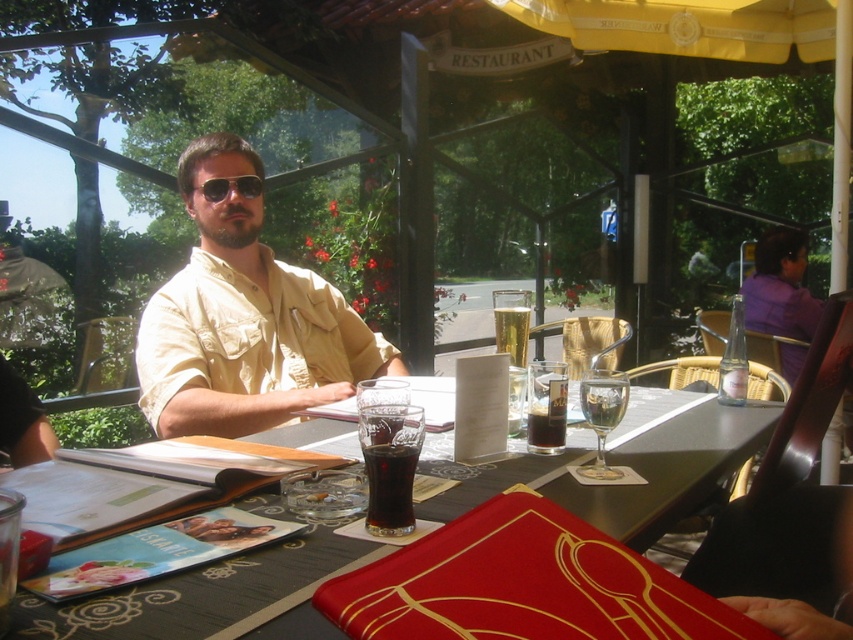
Question: Is beige cotton shirt at center below matte black sunglasses at center?

Choices:
 (A) no
 (B) yes

Answer: (B)

Question: Among these objects, which one is nearest to the camera?

Choices:
 (A) clear glass wine glass at table center
 (B) dark brown glass at table center

Answer: (A)

Question: Which point is farther to the camera?

Choices:
 (A) click(561, 417)
 (B) click(601, 451)
 (C) click(142, 352)
 (D) click(242, 184)

Answer: (D)

Question: Can you confirm if dark glass coca-cola at center is bigger than matte black sunglasses at center?

Choices:
 (A) yes
 (B) no

Answer: (B)

Question: Which is nearer to the clear glass wine glass at table center?

Choices:
 (A) matte glass table at center
 (B) dark brown glass at table center
 (C) matte black sunglasses at center

Answer: (B)

Question: Is clear glass wine glass at table center to the right of dark brown glass at table center from the viewer's perspective?

Choices:
 (A) yes
 (B) no

Answer: (A)